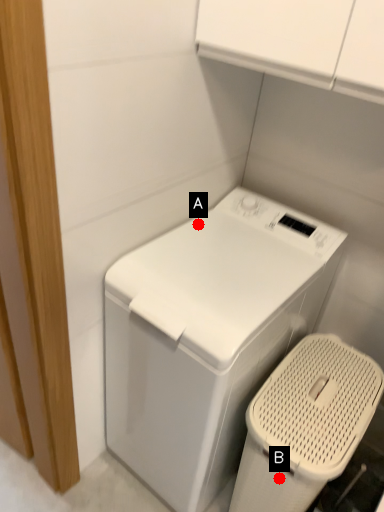
Question: Two points are circled on the image, labeled by A and B beside each circle. Among these points, which one is farthest from the camera?

Choices:
 (A) A is further
 (B) B is further

Answer: (A)